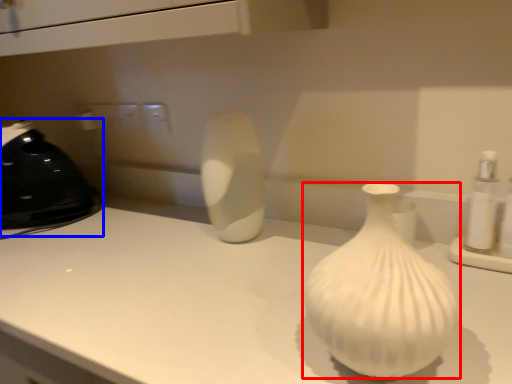
Question: Which object appears closest to the camera in this image, vase (highlighted by a red box) or appliance (highlighted by a blue box)?

Choices:
 (A) vase
 (B) appliance

Answer: (A)